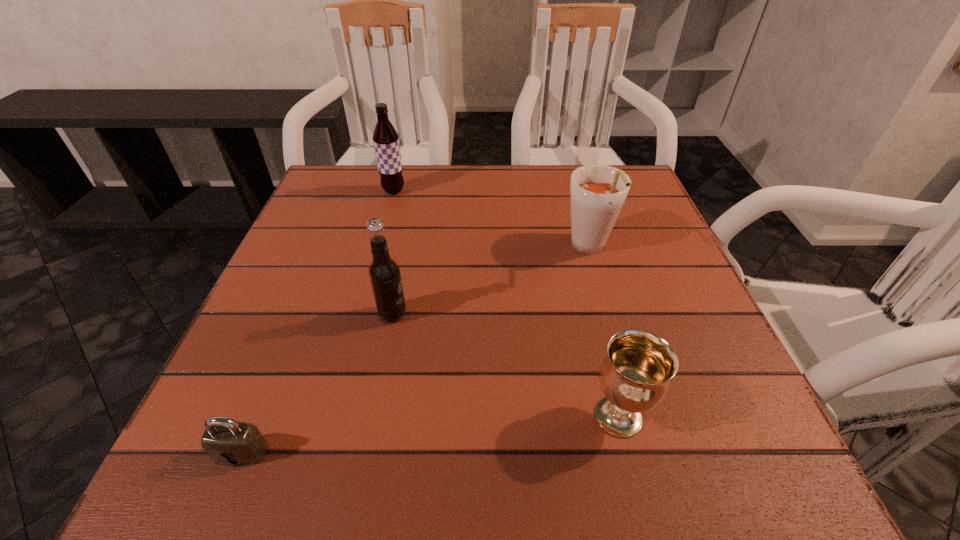
Identify which object is the third closest to the chalice. Please provide its 2D coordinates. Your answer should be formatted as a tuple, i.e. [(x, y)], where the tuple contains the x and y coordinates of a point satisfying the conditions above.

[(228, 442)]

You are a GUI agent. You are given a task and a screenshot of the screen. Output one action in this format:
    pyautogui.click(x=<x>, y=<y>)
    Task: Click on the root beer that can be found as the second closest to the leftmost object
    Image resolution: width=960 pixels, height=540 pixels.
    Given the screenshot: What is the action you would take?
    pyautogui.click(x=597, y=192)

Select which root beer appears as the second closest to the second root beer from left to right. Please provide its 2D coordinates. Your answer should be formatted as a tuple, i.e. [(x, y)], where the tuple contains the x and y coordinates of a point satisfying the conditions above.

[(386, 139)]

Find the location of `vacant region that satisfies the following two spatial constraints: 1. on the drink side of the rightmost root beer; 2. on the label of the second root beer from left to right`. vacant region that satisfies the following two spatial constraints: 1. on the drink side of the rightmost root beer; 2. on the label of the second root beer from left to right is located at coordinates [608, 314].

The width and height of the screenshot is (960, 540). What are the coordinates of `blank space that satisfies the following two spatial constraints: 1. on the front side of the chalice; 2. on the right side of the leftmost root beer` in the screenshot? It's located at (334, 416).

Where is `free space that satisfies the following two spatial constraints: 1. on the label of the second root beer from right to left; 2. on the back side of the chalice`? This screenshot has width=960, height=540. free space that satisfies the following two spatial constraints: 1. on the label of the second root beer from right to left; 2. on the back side of the chalice is located at coordinates (372, 416).

Find the location of a particular element. vacant space that satisfies the following two spatial constraints: 1. on the label of the third nearest object; 2. at the front of the padlock near the keyhole is located at coordinates (365, 453).

Image resolution: width=960 pixels, height=540 pixels. Find the location of `free space that satisfies the following two spatial constraints: 1. on the label of the second shortest object; 2. on the left side of the third object from left to right`. free space that satisfies the following two spatial constraints: 1. on the label of the second shortest object; 2. on the left side of the third object from left to right is located at coordinates pos(372,416).